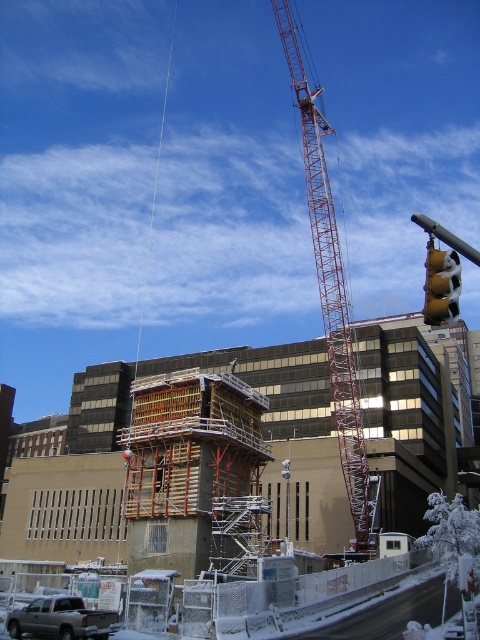
Question: Which point is closer to the camera taking this photo?

Choices:
 (A) (430, 282)
 (B) (348, 403)

Answer: (A)

Question: From the image, what is the correct spatial relationship of silver metallic truck at lower left in relation to yellow matte traffic light at right?

Choices:
 (A) left
 (B) right

Answer: (A)

Question: Which of the following is the farthest from the observer?

Choices:
 (A) (340, 452)
 (B) (27, 621)

Answer: (A)

Question: Which of the following is the closest to the observer?

Choices:
 (A) silver metallic truck at lower left
 (B) yellow matte traffic light at right

Answer: (A)

Question: Can you confirm if red metal crane at center is smaller than yellow matte traffic light at right?

Choices:
 (A) no
 (B) yes

Answer: (A)

Question: Is silver metallic truck at lower left to the left of yellow matte traffic light at right from the viewer's perspective?

Choices:
 (A) no
 (B) yes

Answer: (B)